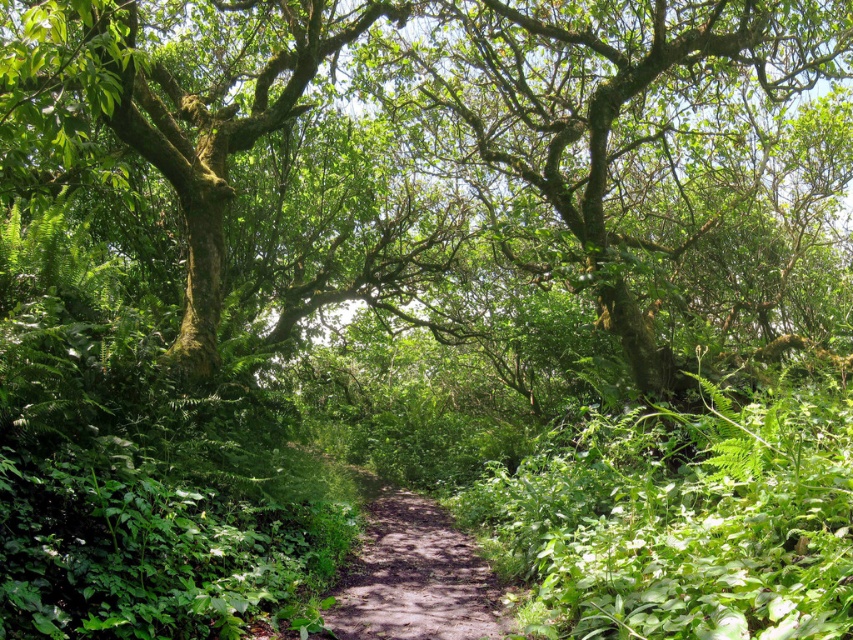
Can you confirm if green mossy tree at center is positioned below dirt path at center?

No, green mossy tree at center is not below dirt path at center.

Is green mossy tree at center behind dirt path at center?

No, green mossy tree at center is in front of dirt path at center.

Consider the image. Who is more forward, (646, 93) or (381, 620)?

Point (381, 620)

Locate an element on the screen. This screenshot has height=640, width=853. green mossy tree at center is located at coordinates tap(453, 170).